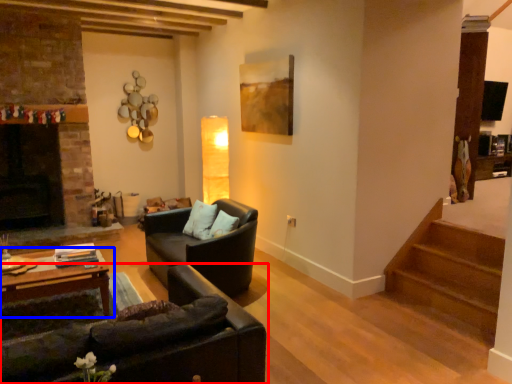
Question: Which object appears farthest to the camera in this image, studio couch (highlighted by a red box) or table (highlighted by a blue box)?

Choices:
 (A) studio couch
 (B) table

Answer: (B)